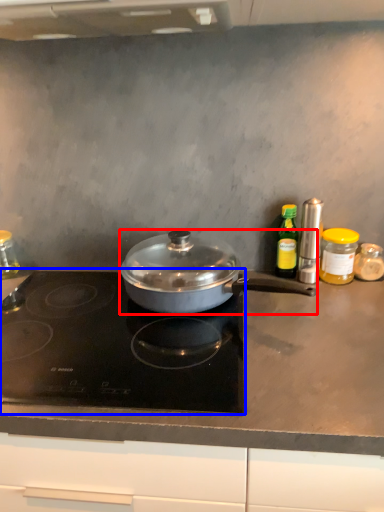
Question: Which object appears farthest to the camera in this image, kitchen appliance (highlighted by a red box) or gas stove (highlighted by a blue box)?

Choices:
 (A) kitchen appliance
 (B) gas stove

Answer: (A)